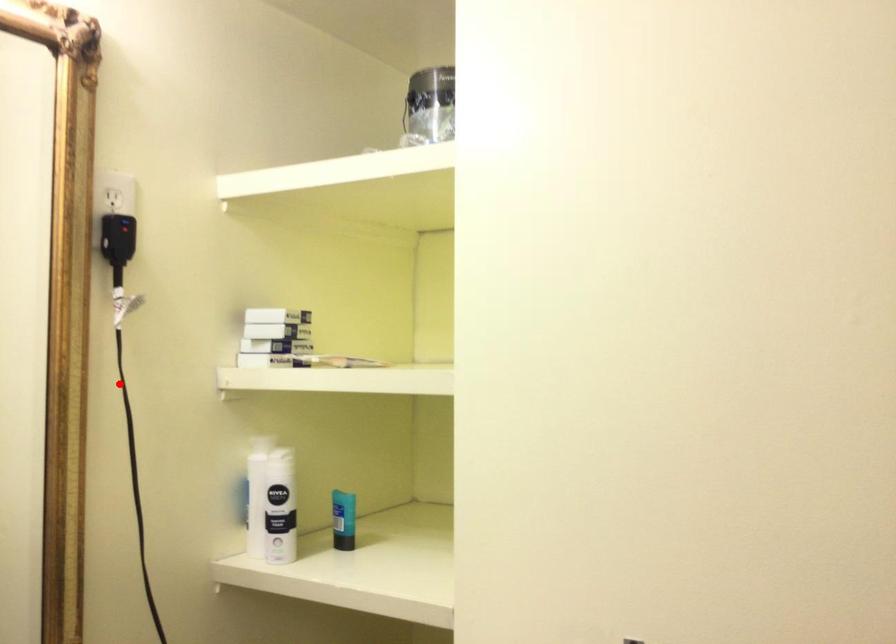
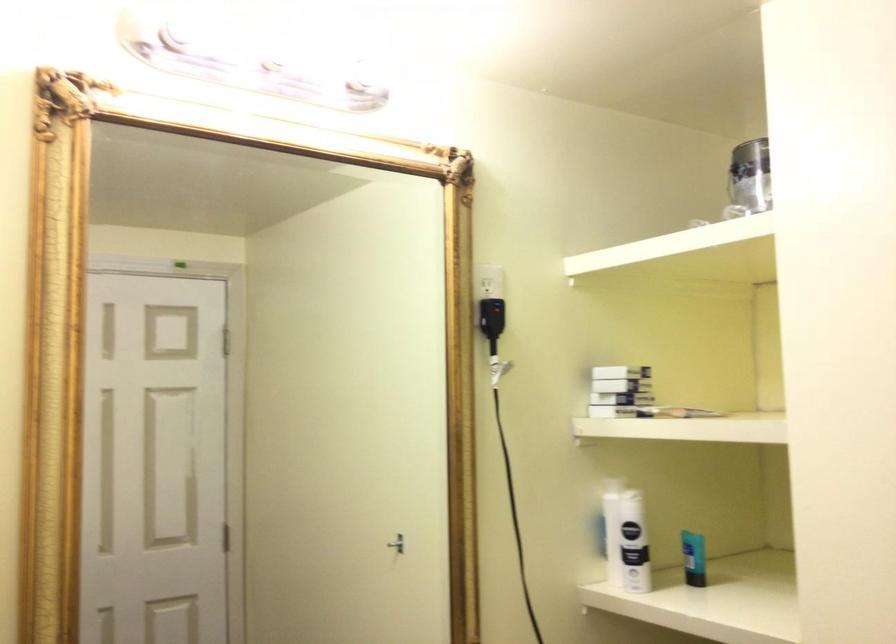
Question: I am providing you with two images of the same scene from different viewpoints. In image1, a red point is highlighted. Considering the same 3D point in image2, which of the following is correct?

Choices:
 (A) It is closer
 (B) It is farther

Answer: (B)